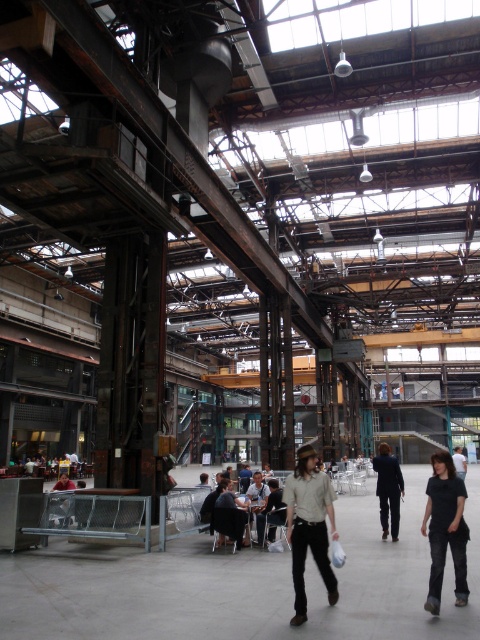
You are a photographer setting up a shoot in this industrial space. You notice a khaki cotton shirt at center and a dark brown leather jacket at center. Which clothing item should you position closer to the camera to ensure it appears larger in the final photo?

The khaki cotton shirt at center is not as tall as the dark brown leather jacket at center, so to make it appear larger in the photo, you should position the khaki cotton shirt at center closer to the camera.

Looking at this image, you are organizing a small event in this industrial space and need to place two chairs. The chairs must be positioned so that they are exactly 15 feet apart. You have the khaki cotton shirt at center and the black cotton shirt at lower right as reference points. Can you position the chairs to meet the requirement?

The distance between the khaki cotton shirt at center and the black cotton shirt at lower right is 16.38 feet, which is slightly more than the required 15 feet. Therefore, you can position the chairs at these two reference points to achieve the desired distance.